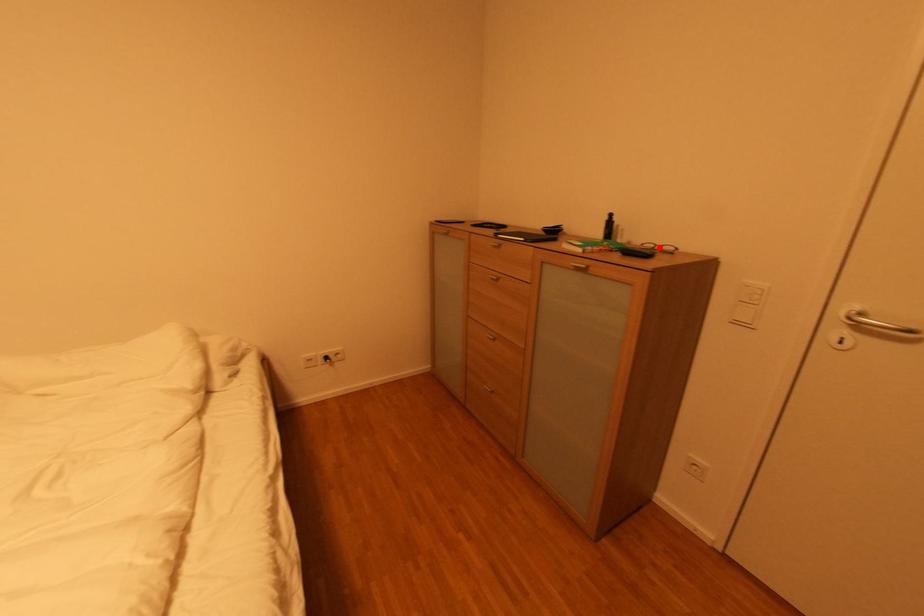
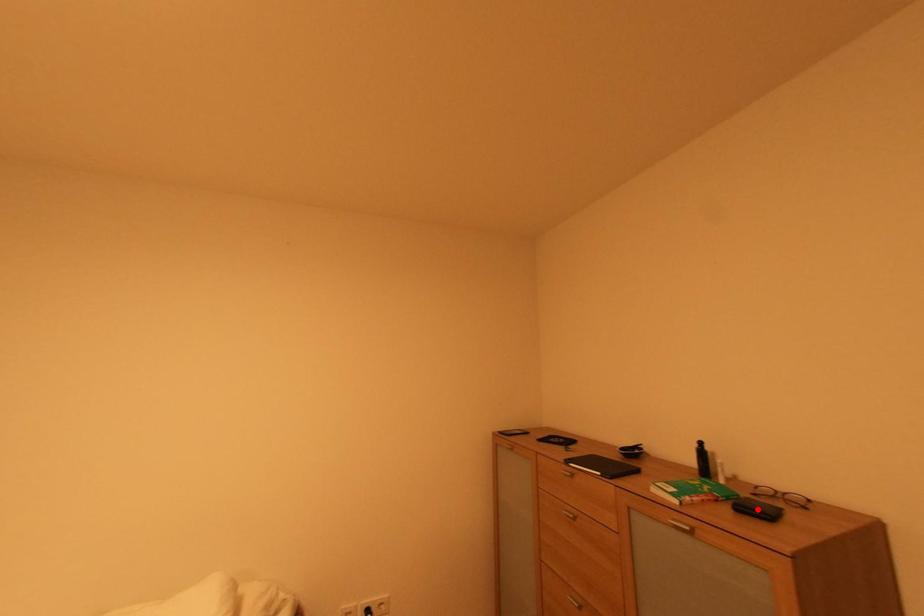
I am providing you with two images of the same scene from different viewpoints. A red point is marked on the first image and another point is marked on the second image. Is the red point in image1 aligned with the point shown in image2?

No